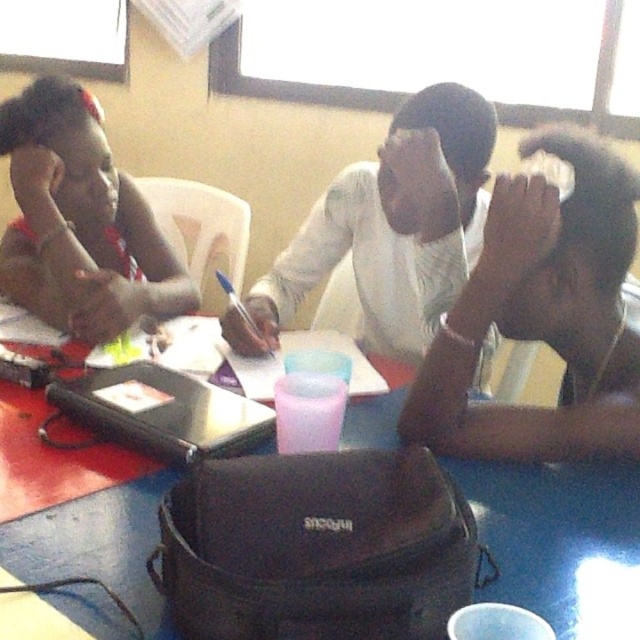
Question: Which is farther from the smooth skin head at center?

Choices:
 (A) white matte shirt at center
 (B) matte black laptop at left

Answer: (B)

Question: Among these points, which one is nearest to the camera?

Choices:
 (A) (358, 435)
 (B) (420, 419)
 (C) (60, 237)

Answer: (B)

Question: Is smooth skin head at center above white matte shirt at center?

Choices:
 (A) yes
 (B) no

Answer: (B)

Question: Which object is closer to the camera taking this photo?

Choices:
 (A) matte black laptop at left
 (B) black matte laptop at center
 (C) blue plastic table at center

Answer: (C)

Question: Does white matte shirt at center appear on the right side of matte black laptop at left?

Choices:
 (A) no
 (B) yes

Answer: (B)

Question: Can you confirm if white matte shirt at center is positioned below matte black laptop at left?

Choices:
 (A) no
 (B) yes

Answer: (B)